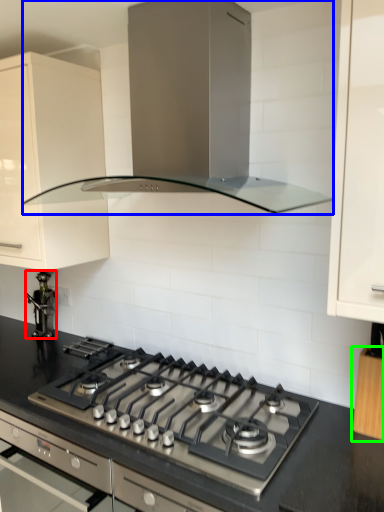
Question: Which object is positioned farthest from appliance (highlighted by a red box)? Select from home appliance (highlighted by a blue box) and cabinetry (highlighted by a green box).

Choices:
 (A) home appliance
 (B) cabinetry

Answer: (B)